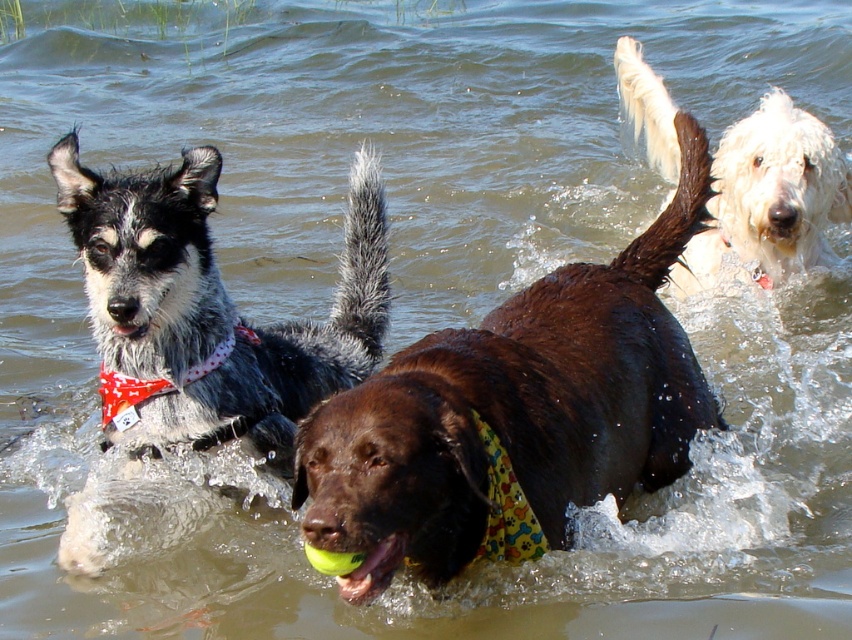
Question: Estimate the real-world distances between objects in this image. Which object is farther from the brown shiny dog at center?

Choices:
 (A) spotted fur dog at left
 (B) white fluffy dog at upper right
 (C) yellow rubber ball at center

Answer: (B)

Question: Can you confirm if white fluffy dog at upper right is positioned to the left of yellow rubber ball at center?

Choices:
 (A) no
 (B) yes

Answer: (A)

Question: Which point is closer to the camera taking this photo?

Choices:
 (A) (734, 152)
 (B) (395, 570)
 (C) (419, 388)

Answer: (B)

Question: Can you confirm if spotted fur dog at left is positioned below yellow rubber ball at center?

Choices:
 (A) no
 (B) yes

Answer: (A)

Question: Is brown shiny dog at center above white fluffy dog at upper right?

Choices:
 (A) no
 (B) yes

Answer: (A)

Question: Based on their relative distances, which object is farther from the white fluffy dog at upper right?

Choices:
 (A) yellow rubber ball at center
 (B) brown shiny dog at center

Answer: (A)